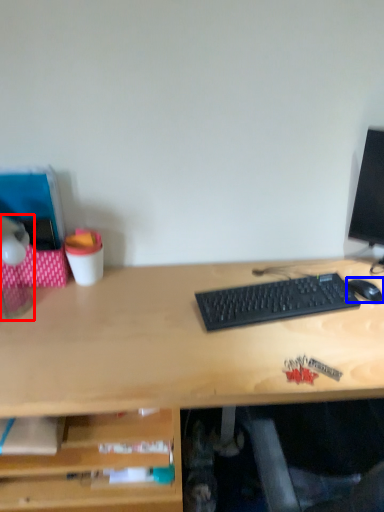
Question: Which object is further to the camera taking this photo, table lamp (highlighted by a red box) or mouse (highlighted by a blue box)?

Choices:
 (A) table lamp
 (B) mouse

Answer: (B)